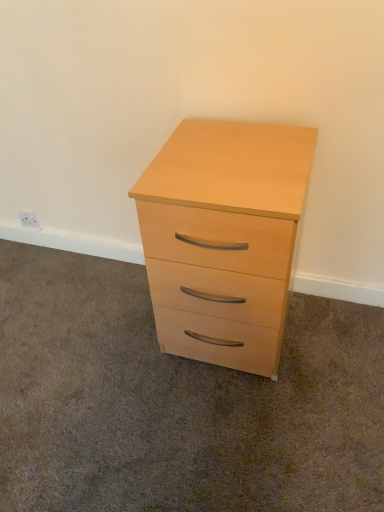
Question: Does light wood chest of drawers at center appear on the left side of light wood drawer at center?

Choices:
 (A) yes
 (B) no

Answer: (B)

Question: Is light wood chest of drawers at center smaller than light wood drawer at center?

Choices:
 (A) no
 (B) yes

Answer: (A)

Question: Is light wood chest of drawers at center positioned before light wood drawer at center?

Choices:
 (A) no
 (B) yes

Answer: (A)

Question: Does light wood chest of drawers at center appear on the right side of light wood drawer at center?

Choices:
 (A) yes
 (B) no

Answer: (A)

Question: Does light wood chest of drawers at center have a lesser width compared to light wood drawer at center?

Choices:
 (A) no
 (B) yes

Answer: (B)

Question: From a real-world perspective, is light wood chest of drawers at center physically above light wood drawer at center?

Choices:
 (A) yes
 (B) no

Answer: (A)

Question: Can you confirm if light wood drawer at center is shorter than light wood chest of drawers at center?

Choices:
 (A) no
 (B) yes

Answer: (B)

Question: Is light wood chest of drawers at center at the back of light wood drawer at center?

Choices:
 (A) no
 (B) yes

Answer: (A)

Question: Considering the relative sizes of light wood drawer at center and light wood chest of drawers at center in the image provided, is light wood drawer at center wider than light wood chest of drawers at center?

Choices:
 (A) no
 (B) yes

Answer: (B)

Question: From the image's perspective, is light wood drawer at center located above light wood chest of drawers at center?

Choices:
 (A) yes
 (B) no

Answer: (B)

Question: Is light wood drawer at center at the right side of light wood chest of drawers at center?

Choices:
 (A) yes
 (B) no

Answer: (B)

Question: Is light wood drawer at center with light wood chest of drawers at center?

Choices:
 (A) no
 (B) yes

Answer: (A)

Question: Does point (x=319, y=347) appear closer or farther from the camera than point (x=258, y=179)?

Choices:
 (A) closer
 (B) farther

Answer: (B)